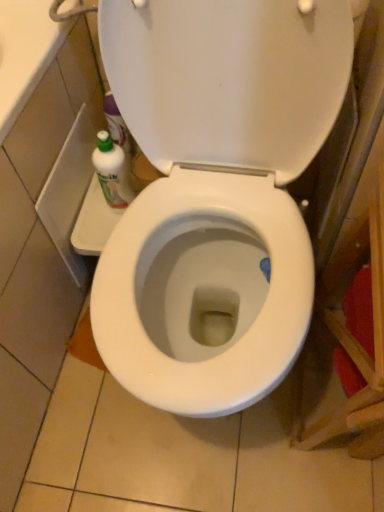
What is the approximate width of translucent plastic bottle at left?

It is 2.71 inches.

The width and height of the screenshot is (384, 512). What do you see at coordinates (112, 172) in the screenshot?
I see `translucent plastic bottle at left` at bounding box center [112, 172].

Based on the photo, measure the distance between point (x=125, y=179) and camera.

They are 36.46 inches apart.

Where is `translucent plastic bottle at left`? translucent plastic bottle at left is located at coordinates (112, 172).

Where is `translucent plastic bottle at left`? Image resolution: width=384 pixels, height=512 pixels. translucent plastic bottle at left is located at coordinates (112, 172).